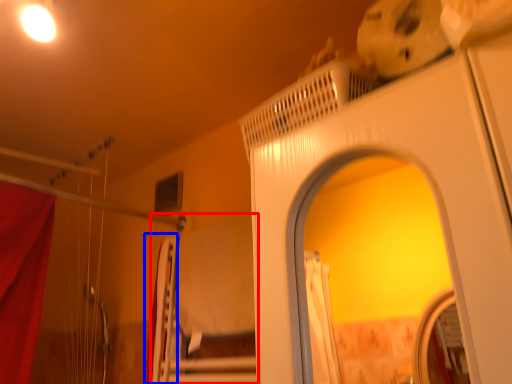
Question: Which object is further to the camera taking this photo, bed (highlighted by a red box) or curtain (highlighted by a blue box)?

Choices:
 (A) bed
 (B) curtain

Answer: (B)